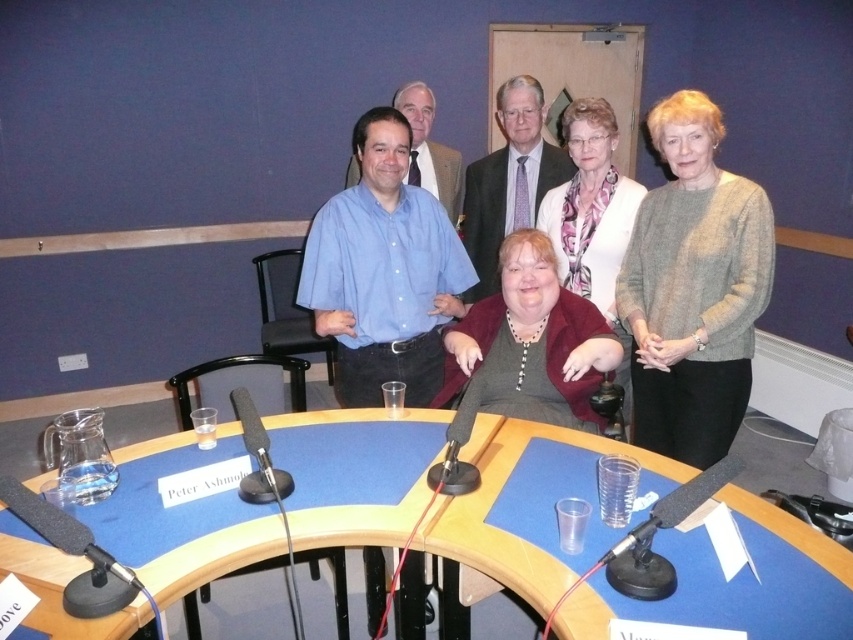
You are a photographer standing behind the curved wooden table where the matte burgundy sweater at center and the matte blue shirt at center are seated. You want to take a photo that includes both of them without any obstructions. Given that the distance between them is 3.33 feet, what is the minimum width of the camera lens you need to capture both subjects in the frame?

The minimum width of the camera lens needed to capture both the matte burgundy sweater at center and the matte blue shirt at center is 3.33 feet, as they are separated by that distance.

You are organizing a panel discussion and need to set up the stage. You have two tables available, the blue wood table at center and the blue fabric table at center. Which table should you choose if you want the one that is shorter in height?

The blue wood table at center has a lesser height compared to the blue fabric table at center, so you should choose the blue wood table at center for a shorter table.

You are standing at the point labeled as point [585,589]. You want to move to the central power source connected to the microphones on the table. Can you reach it without moving past the table?

The central power source is connected to the microphones on the table, so it is likely located under or near the table. Since you are at point [585,589], which is 1.27 meters away from the viewer, you can reach it without moving past the table by moving towards the table.